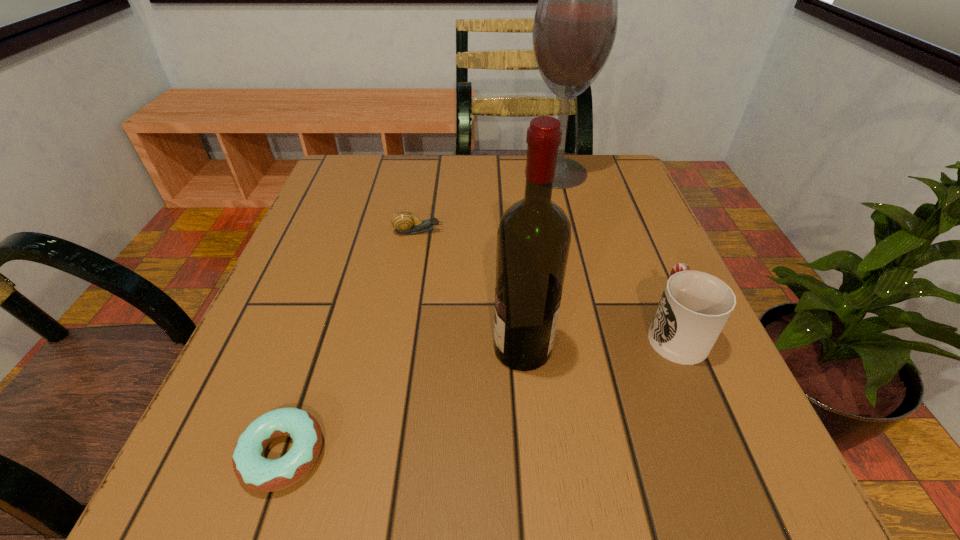
Image resolution: width=960 pixels, height=540 pixels. What are the coordinates of `object that stands as the third closest to the nearer alcohol` in the screenshot? It's located at (404, 222).

The image size is (960, 540). What are the coordinates of `object that can be found as the fourth closest to the doughnut` in the screenshot? It's located at (575, 24).

Where is `free space in the image that satisfies the following two spatial constraints: 1. on the front side of the farthest object; 2. on the front-facing side of the second shortest object`? free space in the image that satisfies the following two spatial constraints: 1. on the front side of the farthest object; 2. on the front-facing side of the second shortest object is located at coordinates (570, 232).

The width and height of the screenshot is (960, 540). Find the location of `vacant space that satisfies the following two spatial constraints: 1. on the front-facing side of the fourth nearest object; 2. on the handle side of the third tallest object`. vacant space that satisfies the following two spatial constraints: 1. on the front-facing side of the fourth nearest object; 2. on the handle side of the third tallest object is located at coordinates (401, 331).